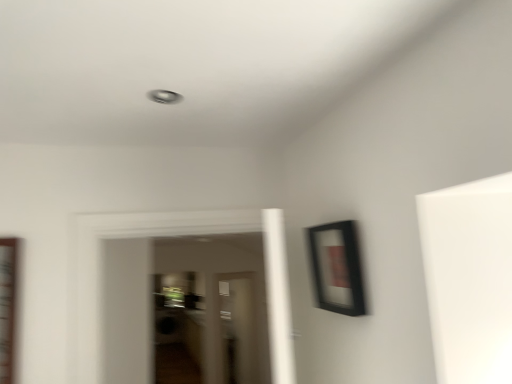
Describe the element at coordinates (337, 268) in the screenshot. I see `black matte picture frame at upper right` at that location.

Locate an element on the screen. Image resolution: width=512 pixels, height=384 pixels. black matte picture frame at upper right is located at coordinates (337, 268).

Identify the location of black matte picture frame at upper right. Image resolution: width=512 pixels, height=384 pixels. (337, 268).